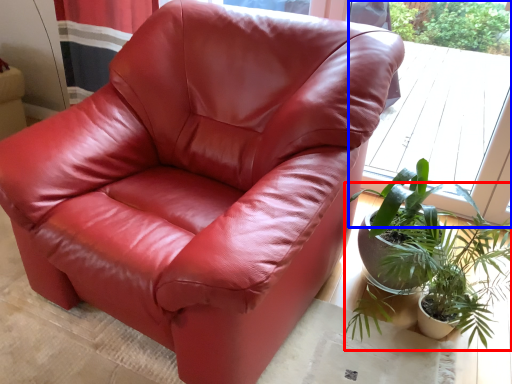
Question: Which object appears closest to the camera in this image, houseplant (highlighted by a red box) or window (highlighted by a blue box)?

Choices:
 (A) houseplant
 (B) window

Answer: (A)